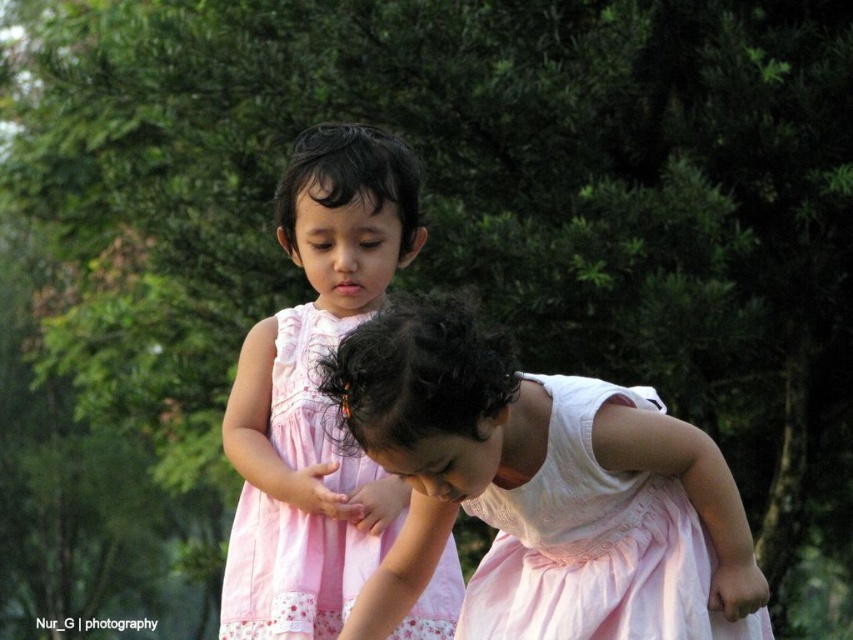
Is pink satin dress at center behind pink cotton dress at center?

No, it is in front of pink cotton dress at center.

Is pink satin dress at center taller than pink cotton dress at center?

No, pink satin dress at center is not taller than pink cotton dress at center.

Is point (531, 524) less distant than point (317, 433)?

Yes, point (531, 524) is closer to viewer.

Image resolution: width=853 pixels, height=640 pixels. Find the location of `pink satin dress at center`. pink satin dress at center is located at coordinates point(593,541).